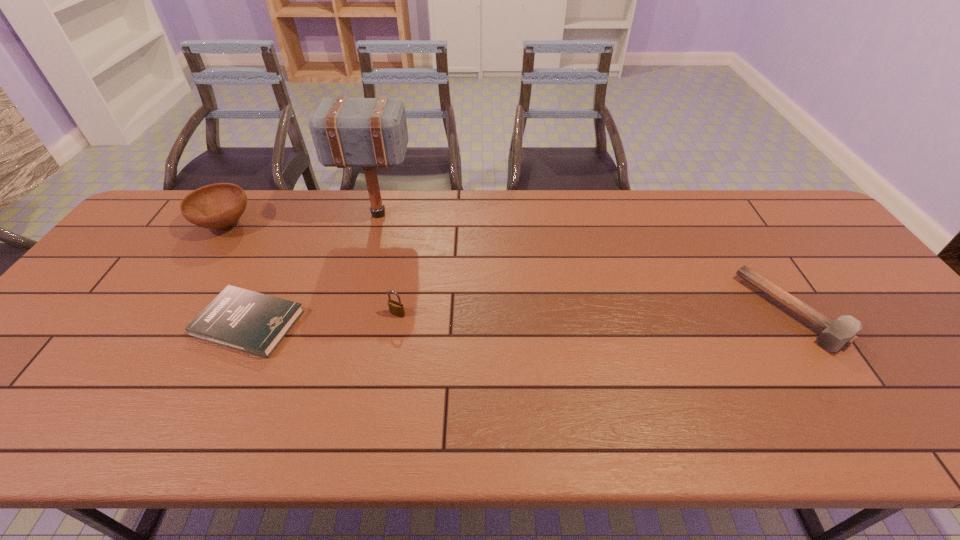
The image size is (960, 540). What are the coordinates of `the farther mallet` in the screenshot? It's located at (347, 132).

The height and width of the screenshot is (540, 960). I want to click on the taller mallet, so click(x=347, y=132).

You are a GUI agent. You are given a task and a screenshot of the screen. Output one action in this format:
    pyautogui.click(x=<x>, y=<y>)
    Task: Click on the leftmost object
    The image size is (960, 540).
    Given the screenshot: What is the action you would take?
    pyautogui.click(x=215, y=206)

Find the location of a particular element. This screenshot has width=960, height=540. the third tallest object is located at coordinates (396, 308).

At what (x,y) coordinates should I click in order to perform the action: click on the second shortest object. Please return your answer as a coordinate pair (x, y). Image resolution: width=960 pixels, height=540 pixels. Looking at the image, I should click on (835, 335).

Where is `the rightmost object`? the rightmost object is located at coordinates (835, 335).

You are a GUI agent. You are given a task and a screenshot of the screen. Output one action in this format:
    pyautogui.click(x=<x>, y=<y>)
    Task: Click on the book
    The width and height of the screenshot is (960, 540).
    Given the screenshot: What is the action you would take?
    pyautogui.click(x=255, y=323)

This screenshot has width=960, height=540. I want to click on the shortest object, so click(x=255, y=323).

The width and height of the screenshot is (960, 540). Find the location of `free space located on the striking surface of the taller mallet`. free space located on the striking surface of the taller mallet is located at coordinates (455, 214).

You are a GUI agent. You are given a task and a screenshot of the screen. Output one action in this format:
    pyautogui.click(x=<x>, y=<y>)
    Task: Click on the vacant space positioned on the front of the bowl
    
    Given the screenshot: What is the action you would take?
    [151, 338]